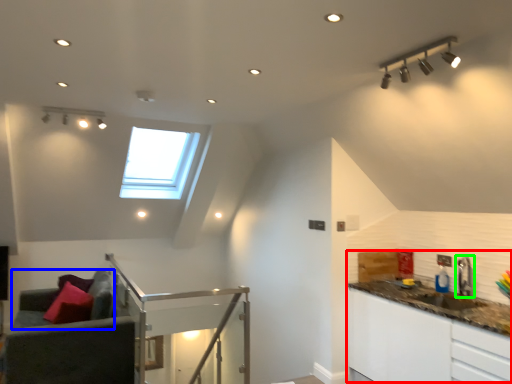
Question: Which object is the closest to the counter top (highlighted by a red box)? Choose among these: couch (highlighted by a blue box) or tap (highlighted by a green box).

Choices:
 (A) couch
 (B) tap

Answer: (B)